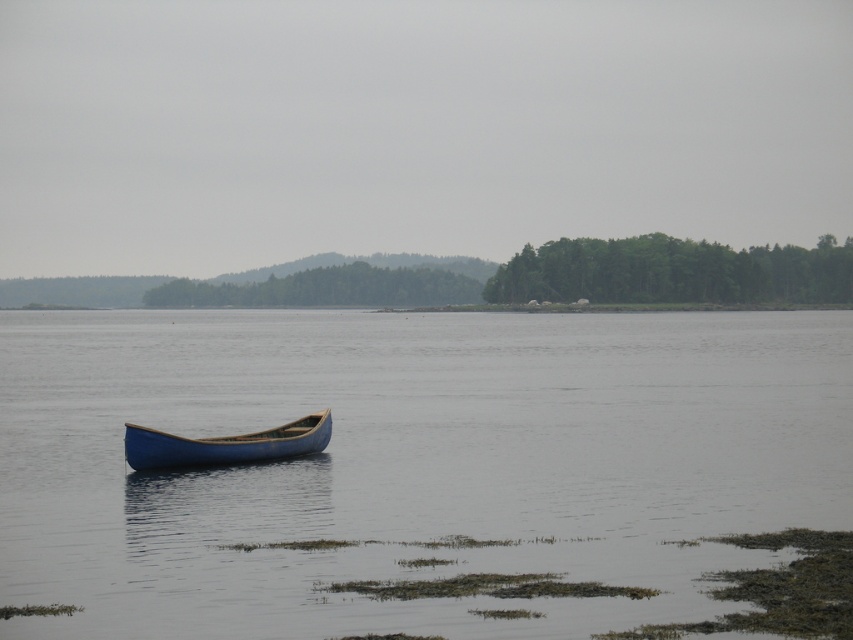
You are standing on the lakeside and see the blue smooth water at center and the blue wooden canoe at center. Which object is positioned to the right of the other?

The blue smooth water at center is to the right of the blue wooden canoe at center according to the description.

You are standing at the edge of the lake and want to locate the blue smooth water at center. According to the coordinates provided, in which direction should you look relative to your position?

You should look towards the direction indicated by the coordinates point at 0.723 on the x axis and 0.482 on the y axis to locate the blue smooth water at center.